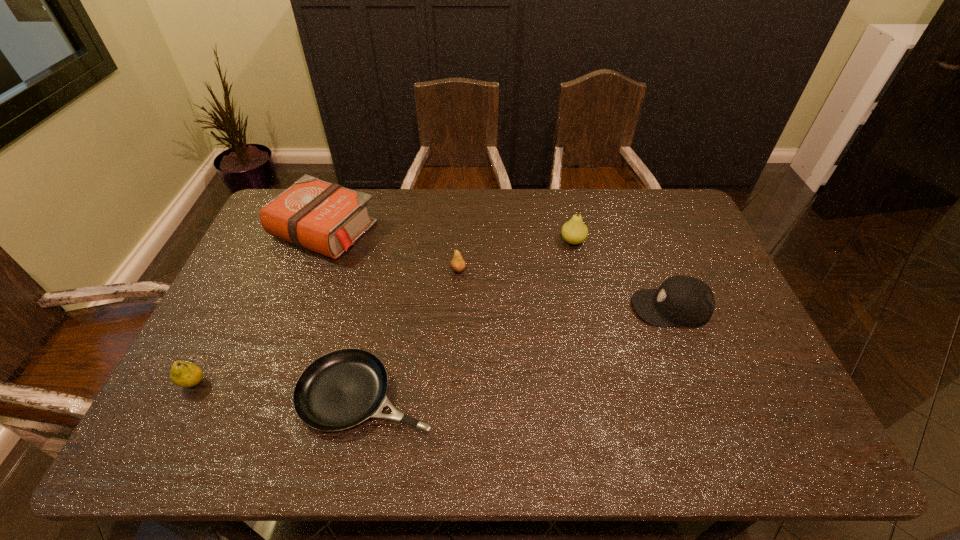
Identify the location of pear that is the second closest to the nearest pear. The width and height of the screenshot is (960, 540). [x=574, y=231].

The height and width of the screenshot is (540, 960). Find the location of `pear identified as the second closest to the Bible`. pear identified as the second closest to the Bible is located at coordinates (184, 374).

You are a GUI agent. You are given a task and a screenshot of the screen. Output one action in this format:
    pyautogui.click(x=<x>, y=<y>)
    Task: Click on the free space that satisfies the following two spatial constraints: 1. on the front-facing side of the cap; 2. on the front side of the nearest pear
    This screenshot has width=960, height=540.
    Given the screenshot: What is the action you would take?
    pyautogui.click(x=701, y=383)